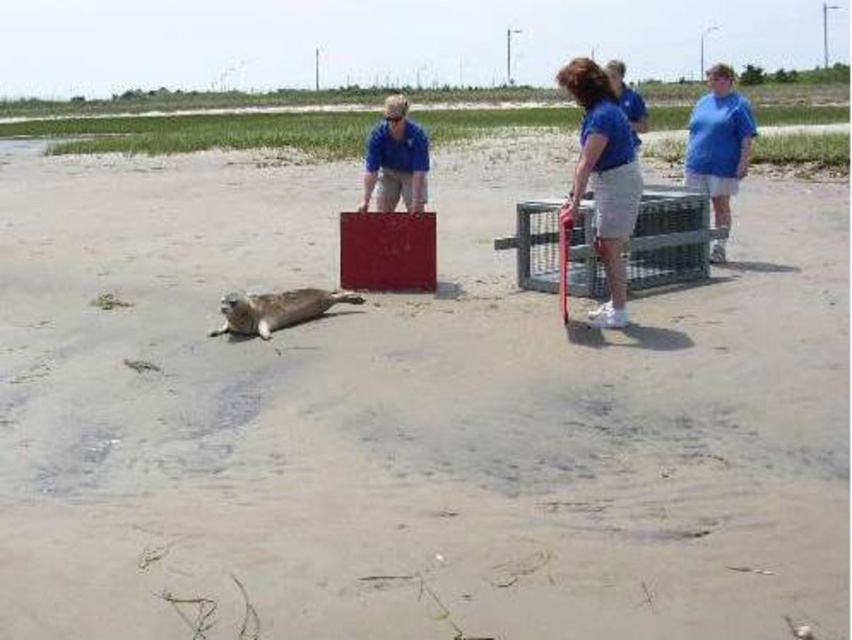
Which is below, matte blue shirt at center or gray fur seal at center?

gray fur seal at center is below.

Consider the image. How distant is matte blue shirt at center from gray fur seal at center?

matte blue shirt at center is 6.06 feet away from gray fur seal at center.

The height and width of the screenshot is (640, 852). What do you see at coordinates (395, 160) in the screenshot?
I see `matte blue shirt at center` at bounding box center [395, 160].

Where is `matte blue shirt at center`? matte blue shirt at center is located at coordinates (395, 160).

The width and height of the screenshot is (852, 640). What do you see at coordinates (603, 177) in the screenshot?
I see `blue cotton shirt at center` at bounding box center [603, 177].

Is blue cotton shirt at center above gray fur seal at center?

Correct, blue cotton shirt at center is located above gray fur seal at center.

The width and height of the screenshot is (852, 640). I want to click on blue cotton shirt at center, so click(603, 177).

Where is `blue cotton shirt at center`? blue cotton shirt at center is located at coordinates (603, 177).

Looking at this image, can you confirm if blue cotton shirt at center is smaller than blue cotton shirt at right?

Yes.

The image size is (852, 640). Identify the location of blue cotton shirt at center. (603, 177).